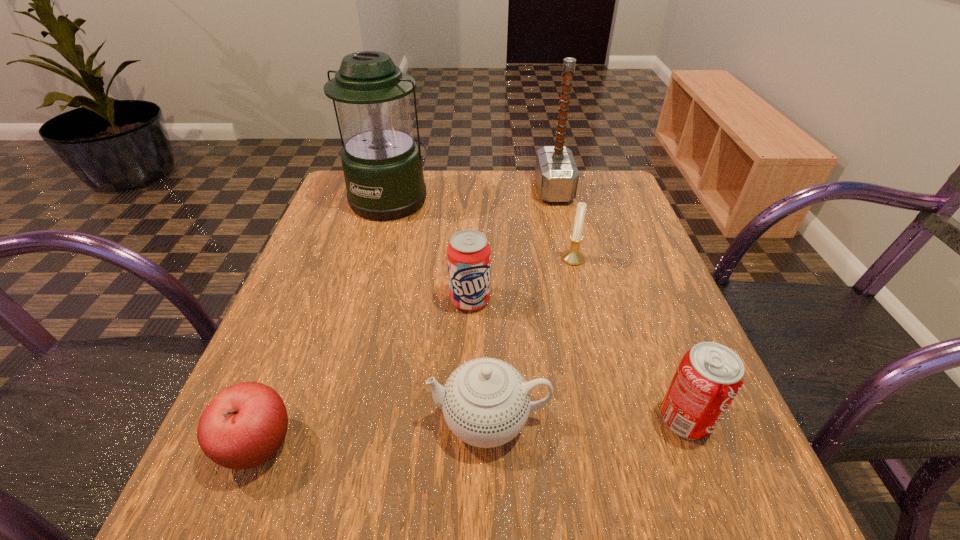
Find the location of a particular element. lantern is located at coordinates (382, 165).

Locate an element on the screen. hammer is located at coordinates (557, 176).

The width and height of the screenshot is (960, 540). Find the location of `the fourth farthest object`. the fourth farthest object is located at coordinates [469, 254].

I want to click on the farther soda can, so click(469, 254).

Identify the location of candle holder. 572,256.

Locate an element on the screen. the rightmost object is located at coordinates (710, 375).

At what (x,y) coordinates should I click in order to perform the action: click on the nearer soda can. Please return your answer as a coordinate pair (x, y). The width and height of the screenshot is (960, 540). Looking at the image, I should click on (710, 375).

Locate an element on the screen. The image size is (960, 540). chinaware is located at coordinates (486, 402).

Find the location of a particular element. The height and width of the screenshot is (540, 960). apple is located at coordinates 244,425.

Identify the location of blank area located 0.190m on the front of the lantern. This screenshot has height=540, width=960. (369, 275).